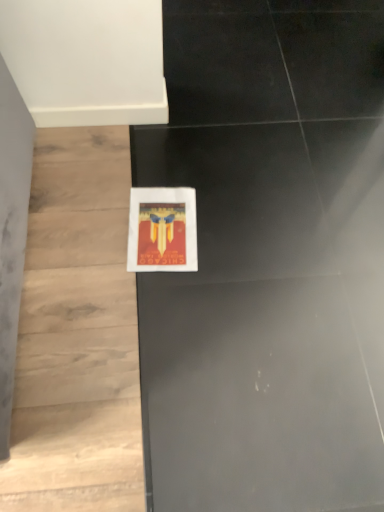
Where is `vacant region to the left of matte paper picture frame at center`? The image size is (384, 512). vacant region to the left of matte paper picture frame at center is located at coordinates (88, 223).